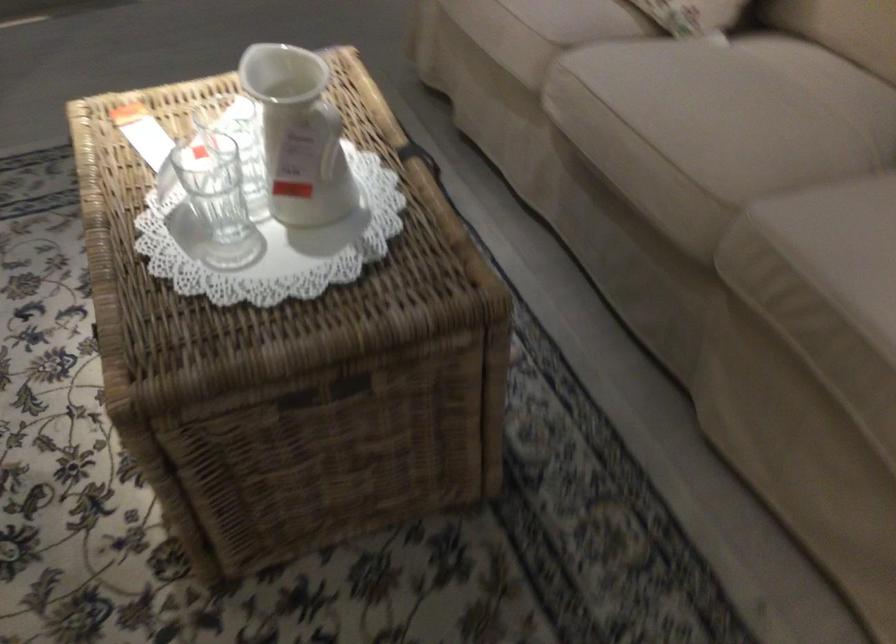
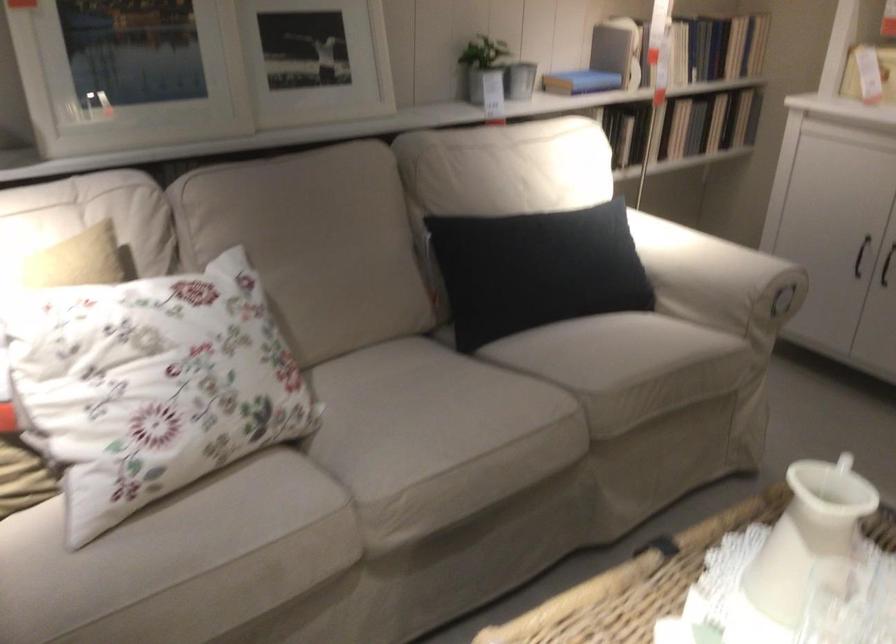
Where in the second image is the point corresponding to the point at 293,155 from the first image?

(803, 552)